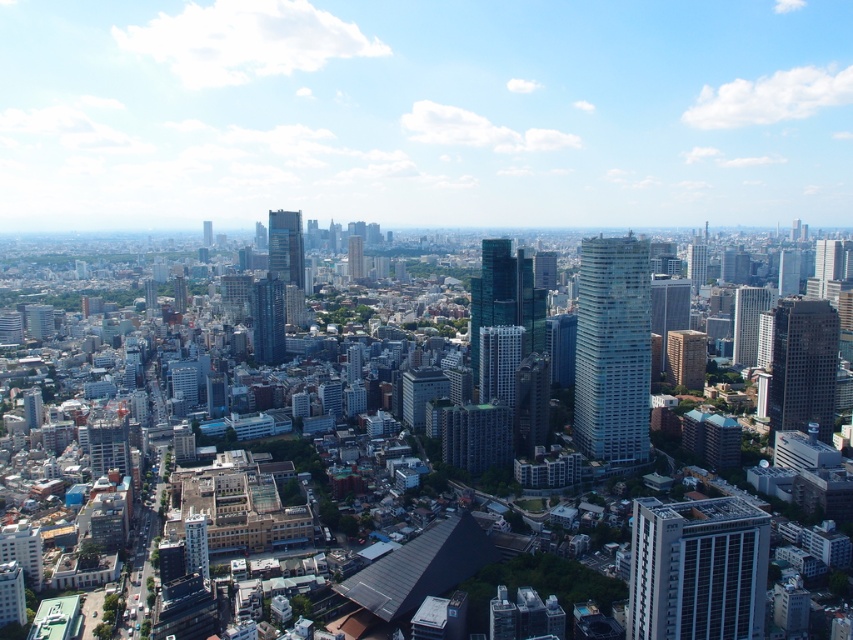
Question: Based on their relative distances, which object is farther from the dark blue glass skyscraper at center?

Choices:
 (A) glassy blue skyscraper at center-right
 (B) glassy reflective skyscraper at center-right

Answer: (B)

Question: Estimate the real-world distances between objects in this image. Which object is farther from the light brown concrete building at center?

Choices:
 (A) dark gray glass skyscraper at center-right
 (B) glassy blue skyscraper at center

Answer: (B)

Question: Can you confirm if dark blue glass skyscraper at center is positioned above light brown concrete building at center?

Choices:
 (A) no
 (B) yes

Answer: (B)

Question: Which of the following is the farthest from the observer?

Choices:
 (A) (573, 369)
 (B) (347, 253)

Answer: (B)

Question: Can you confirm if dark blue glass skyscraper at center is wider than green glass skyscraper at center?

Choices:
 (A) yes
 (B) no

Answer: (A)

Question: Can you confirm if white glass building at center is positioned to the right of green glass skyscraper at center?

Choices:
 (A) yes
 (B) no

Answer: (A)